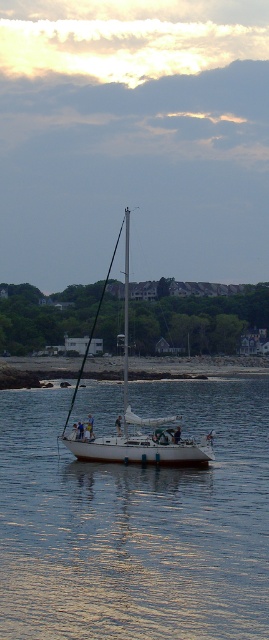
Who is positioned more to the right, white smooth water at center or white glossy mast at center?

Positioned to the right is white smooth water at center.

Does white smooth water at center appear under white glossy mast at center?

Yes.

Identify the location of white smooth water at center. (136, 524).

Locate an element on the screen. white smooth water at center is located at coordinates (136, 524).

Does white matte sailboat at center appear on the left side of white glossy mast at center?

Incorrect, white matte sailboat at center is not on the left side of white glossy mast at center.

Does point (121, 449) come farther from viewer compared to point (126, 314)?

No, it is not.

This screenshot has width=269, height=640. I want to click on white matte sailboat at center, so click(133, 416).

What do you see at coordinates (133, 416) in the screenshot? I see `white matte sailboat at center` at bounding box center [133, 416].

Does point (68, 440) come in front of point (15, 365)?

Yes.

This screenshot has width=269, height=640. I want to click on white matte sailboat at center, so click(x=133, y=416).